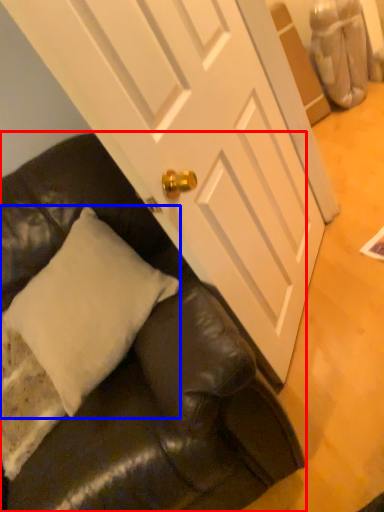
Question: Which of the following is the farthest to the observer, studio couch (highlighted by a red box) or pillow (highlighted by a blue box)?

Choices:
 (A) studio couch
 (B) pillow

Answer: (B)